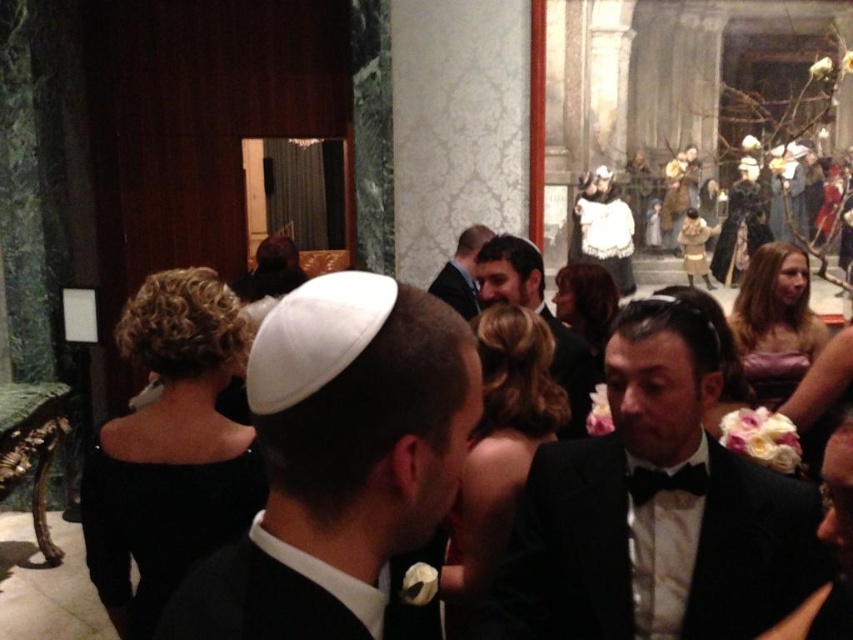
This screenshot has height=640, width=853. In order to click on black velvet dress at center in this screenshot , I will do `click(160, 525)`.

Where is `black velvet dress at center`? The height and width of the screenshot is (640, 853). black velvet dress at center is located at coordinates (160, 525).

Does black velvet dress at center have a smaller size compared to matte black suit at center?

Yes, black velvet dress at center is smaller than matte black suit at center.

Can you confirm if black velvet dress at center is positioned below matte black suit at center?

Yes, black velvet dress at center is below matte black suit at center.

Between point (206, 492) and point (428, 288), which one is positioned in front?

Point (206, 492) is more forward.

Locate an element on the screen. black velvet dress at center is located at coordinates (160, 525).

Measure the distance from white satin kippah at center to matte black suit at center.

white satin kippah at center is 3.11 meters away from matte black suit at center.

The image size is (853, 640). Find the location of `white satin kippah at center`. white satin kippah at center is located at coordinates (606, 477).

Image resolution: width=853 pixels, height=640 pixels. I want to click on white satin kippah at center, so click(606, 477).